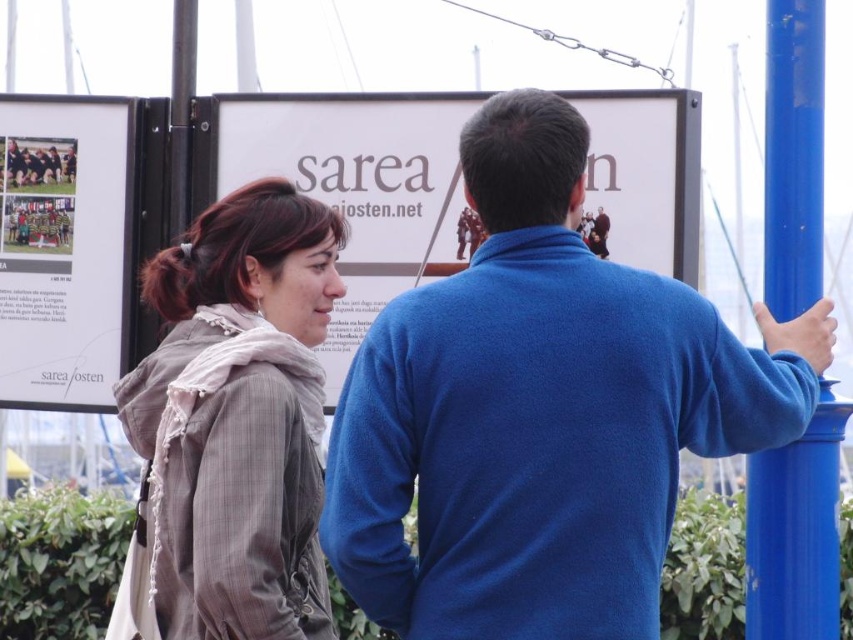
Question: In this image, where is gray textured coat at center located relative to white paper at upper left?

Choices:
 (A) above
 (B) below

Answer: (A)

Question: Observing the image, what is the correct spatial positioning of blue fleece jacket at center in reference to gray textured coat at center?

Choices:
 (A) left
 (B) right

Answer: (B)

Question: Which object is closer to the camera taking this photo?

Choices:
 (A) gray textured coat at center
 (B) blue metallic pole at right
 (C) white paper at upper left
 (D) blue fleece jacket at center

Answer: (D)

Question: Which object is positioned closest to the blue fleece jacket at center?

Choices:
 (A) white paper at upper left
 (B) blue metallic pole at right

Answer: (B)

Question: Is white paper poster at center to the left of white paper at upper left from the viewer's perspective?

Choices:
 (A) no
 (B) yes

Answer: (A)

Question: Which of the following is the closest to the observer?

Choices:
 (A) white paper at upper left
 (B) white paper poster at center
 (C) gray textured coat at center

Answer: (B)